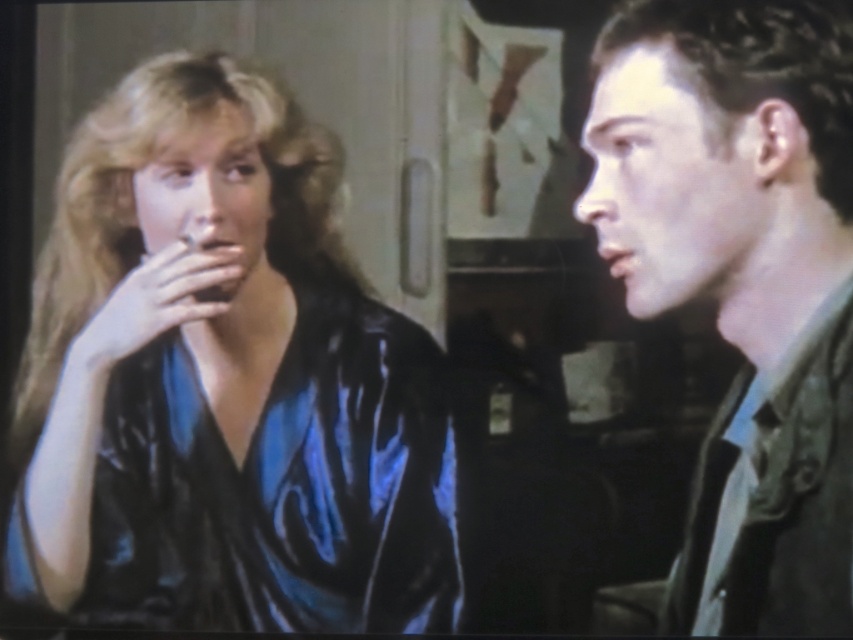
Is the position of shiny blue silk blouse at left less distant than that of matte green jacket at right?

No, shiny blue silk blouse at left is behind matte green jacket at right.

Does shiny blue silk blouse at left come behind matte green jacket at right?

Yes, shiny blue silk blouse at left is behind matte green jacket at right.

The height and width of the screenshot is (640, 853). What are the coordinates of `shiny blue silk blouse at left` in the screenshot? It's located at (223, 381).

Is point (83, 456) positioned after point (845, 298)?

Yes, it is.

In the scene shown: Does shiny blue silk blouse at left have a greater height compared to silky blue robe at right?

Correct, shiny blue silk blouse at left is much taller as silky blue robe at right.

Between point (276, 566) and point (726, 630), which one is positioned in front?

Point (726, 630)

In order to click on shiny blue silk blouse at left in this screenshot , I will do `click(223, 381)`.

Describe the element at coordinates (741, 284) in the screenshot. The image size is (853, 640). I see `matte green jacket at right` at that location.

The image size is (853, 640). What are the coordinates of `matte green jacket at right` in the screenshot? It's located at (741, 284).